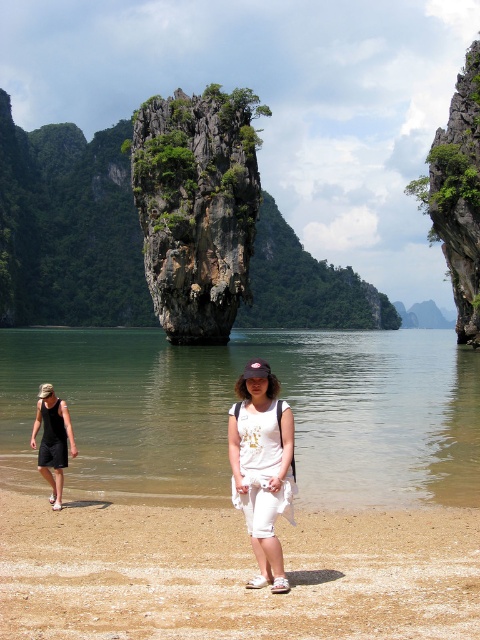
Can you confirm if green mossy rock at center is bigger than green rocky cliff at right?

No.

Is green mossy rock at center positioned before green rocky cliff at right?

No.

What do you see at coordinates (196, 208) in the screenshot? The image size is (480, 640). I see `green mossy rock at center` at bounding box center [196, 208].

Where is `green mossy rock at center`? green mossy rock at center is located at coordinates (196, 208).

Does brown sand at lower center have a smaller size compared to green rocky cliff at right?

Actually, brown sand at lower center might be larger than green rocky cliff at right.

Which is below, brown sand at lower center or green rocky cliff at right?

brown sand at lower center is below.

Who is more distant from viewer, (374, 406) or (469, 332)?

The point (469, 332) is more distant.

Where is `brown sand at lower center`? The image size is (480, 640). brown sand at lower center is located at coordinates (236, 401).

Who is shorter, brown sandy beach at lower center or white cotton shorts at center?

Standing shorter between the two is brown sandy beach at lower center.

How distant is brown sandy beach at lower center from white cotton shorts at center?

brown sandy beach at lower center and white cotton shorts at center are 4.10 meters apart from each other.

Does point (469, 545) lie in front of point (250, 525)?

No, it is behind (250, 525).

Locate an element on the screen. brown sandy beach at lower center is located at coordinates click(x=233, y=573).